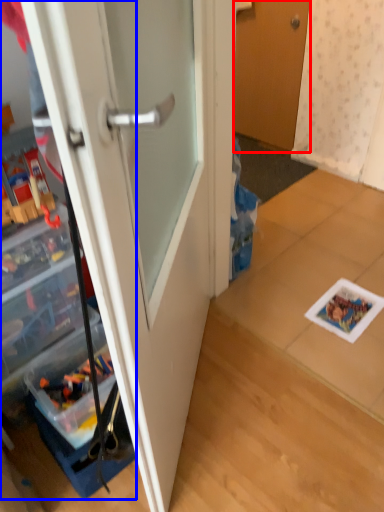
Question: Which of the following is the farthest to the observer, door (highlighted by a red box) or cabinetry (highlighted by a blue box)?

Choices:
 (A) door
 (B) cabinetry

Answer: (A)